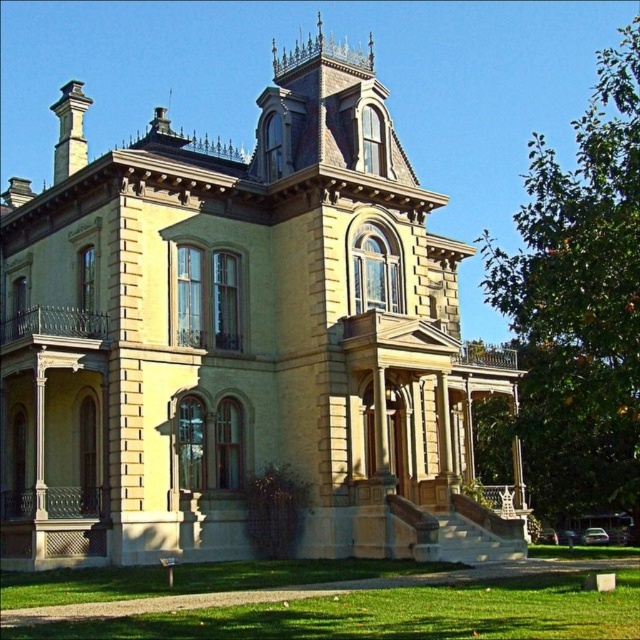
Question: Observing the image, what is the correct spatial positioning of yellow stone mansion at center in reference to green grass at lower center?

Choices:
 (A) left
 (B) right

Answer: (A)

Question: Is yellow stone mansion at center bigger than green grass at lower center?

Choices:
 (A) yes
 (B) no

Answer: (A)

Question: Which point is farther from the camera taking this photo?

Choices:
 (A) (339, 600)
 (B) (104, 458)

Answer: (B)

Question: Which point is closer to the camera?

Choices:
 (A) green grass at lower center
 (B) yellow stone mansion at center

Answer: (A)

Question: Is the position of yellow stone mansion at center more distant than that of green grass at lower center?

Choices:
 (A) yes
 (B) no

Answer: (A)